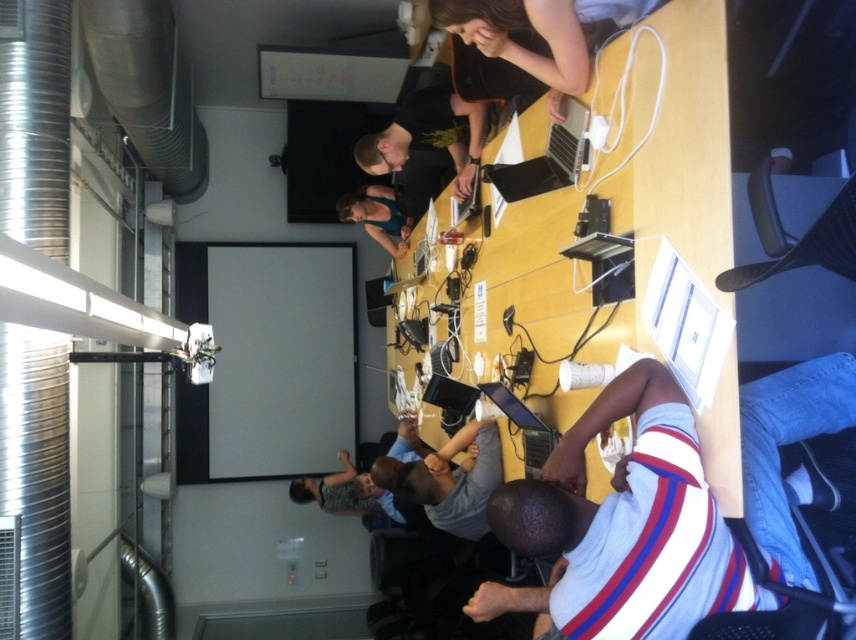
Question: Is blue denim jeans at lower right closer to camera compared to gray fabric shirt at center?

Choices:
 (A) yes
 (B) no

Answer: (A)

Question: Can you confirm if gray fabric shirt at center is bigger than black matte shirt at upper center?

Choices:
 (A) yes
 (B) no

Answer: (B)

Question: Which is farther from the white striped shirt at lower right?

Choices:
 (A) teal fabric shirt at center
 (B) striped jersey at center
 (C) gray fabric shirt at center

Answer: (A)

Question: Which of these objects is positioned farthest from the teal fabric shirt at center?

Choices:
 (A) gray fabric shirt at center
 (B) matte black laptop at upper center

Answer: (B)

Question: Does white striped shirt at lower right lie in front of black matte shirt at upper center?

Choices:
 (A) no
 (B) yes

Answer: (B)

Question: Which object appears farthest from the camera in this image?

Choices:
 (A) black matte shirt at upper center
 (B) gray fabric shirt at center
 (C) white striped shirt at lower right
 (D) matte black laptop at upper center

Answer: (B)